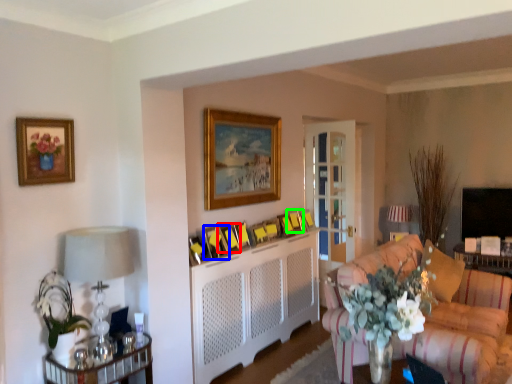
Question: Based on their relative distances, which object is nearer to picture frame (highlighted by a red box)? Choose from picture frame (highlighted by a blue box) and picture frame (highlighted by a green box).

Choices:
 (A) picture frame
 (B) picture frame

Answer: (A)